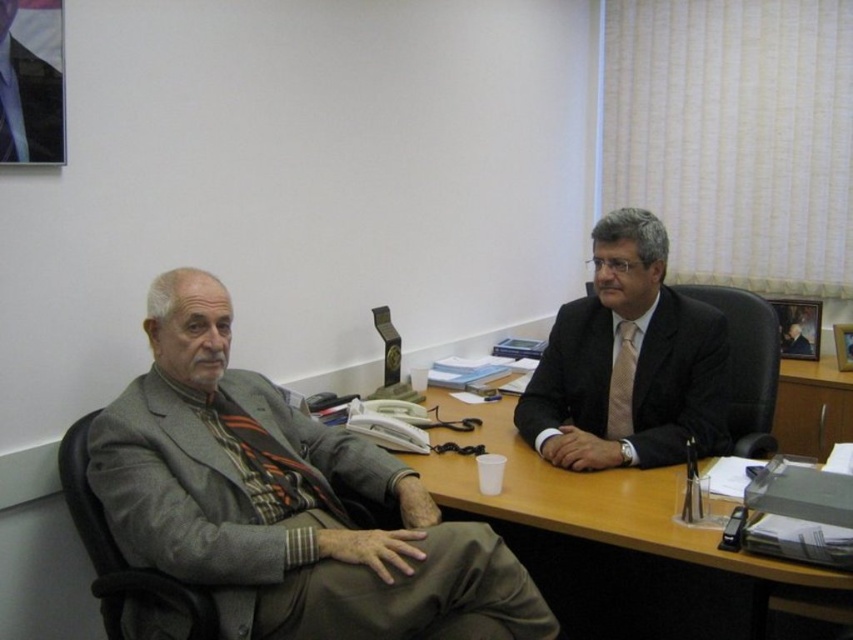
Between wooden desk at center and matte black suit at right, which one has more height?

With more height is matte black suit at right.

Can you confirm if wooden desk at center is thinner than matte black suit at right?

In fact, wooden desk at center might be wider than matte black suit at right.

At what (x,y) coordinates should I click in order to perform the action: click on wooden desk at center. Please return your answer as a coordinate pair (x, y). This screenshot has height=640, width=853. Looking at the image, I should click on (618, 541).

Does point (567, 358) come in front of point (614, 390)?

No.

Does point (651, 419) come behind point (630, 388)?

No, it is in front of (630, 388).

What are the coordinates of `matte black suit at right` in the screenshot? It's located at (677, 381).

Measure the distance from wooden desk at center to beige silk tie at center.

A distance of 41.57 centimeters exists between wooden desk at center and beige silk tie at center.

This screenshot has width=853, height=640. I want to click on wooden desk at center, so click(x=618, y=541).